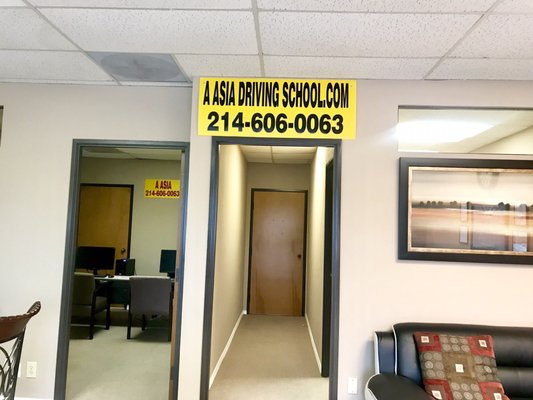
Locate an element on the screen. This screenshot has height=400, width=533. ceiling tiles is located at coordinates (359, 43), (227, 38).